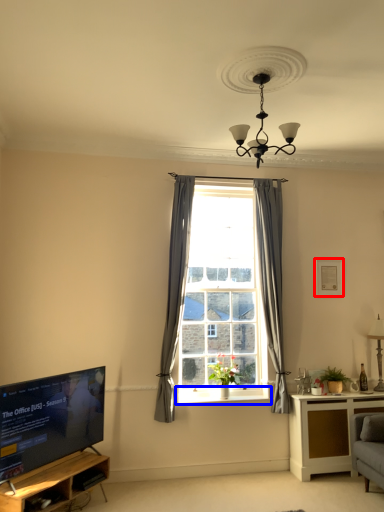
Question: Among these objects, which one is farthest to the camera, picture frame (highlighted by a red box) or window sill (highlighted by a blue box)?

Choices:
 (A) picture frame
 (B) window sill

Answer: (A)